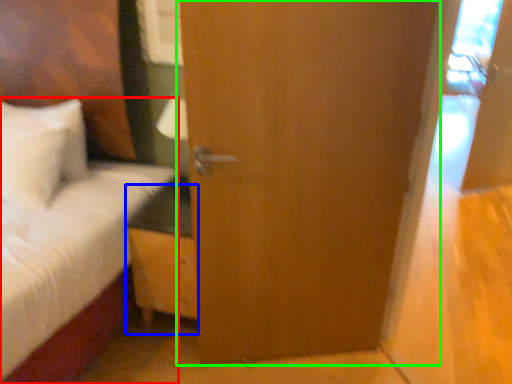
Question: Based on their relative distances, which object is nearer to bed (highlighted by a red box)? Choose from nightstand (highlighted by a blue box) and door (highlighted by a green box).

Choices:
 (A) nightstand
 (B) door

Answer: (A)